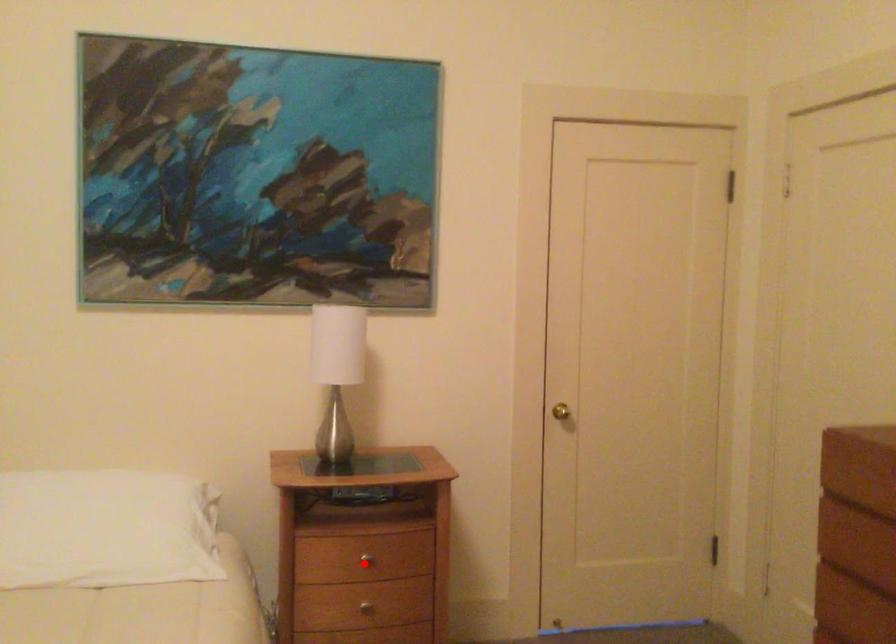
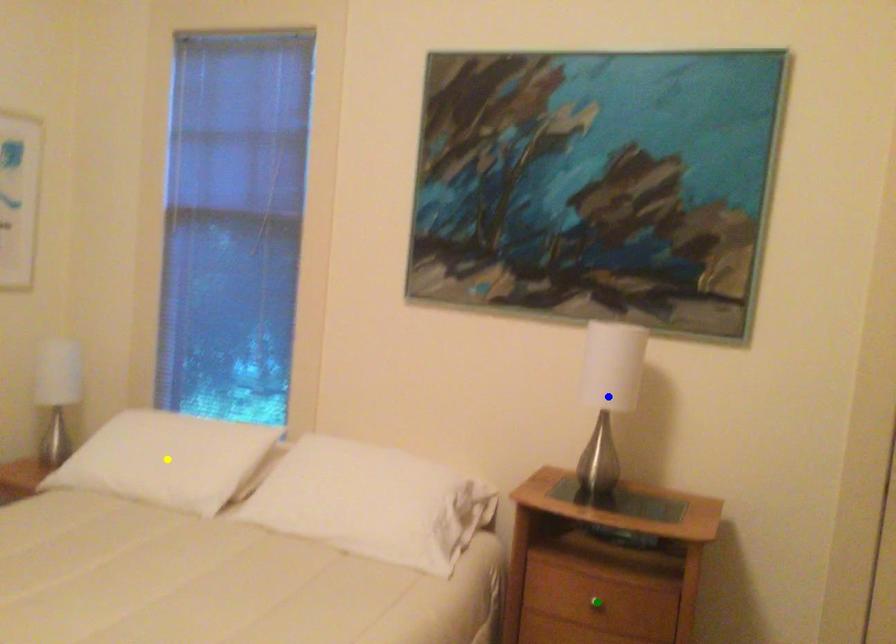
Question: I am providing you with two images of the same scene from different viewpoints. A red point is marked on the first image. You are given multiple points on the second image. Which point in image 2 is actually the same real-world point as the red point in image 1?

Choices:
 (A) yellow point
 (B) green point
 (C) blue point

Answer: (B)